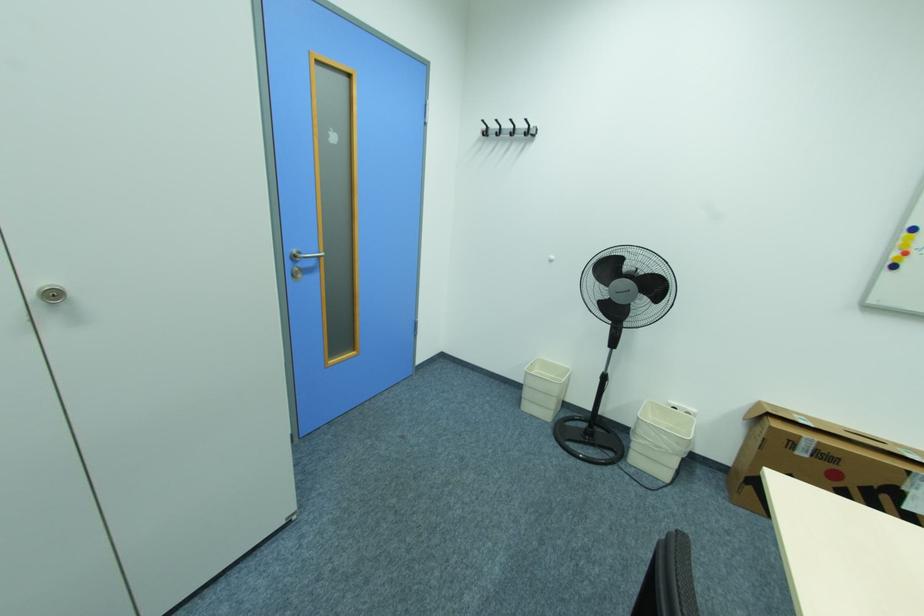
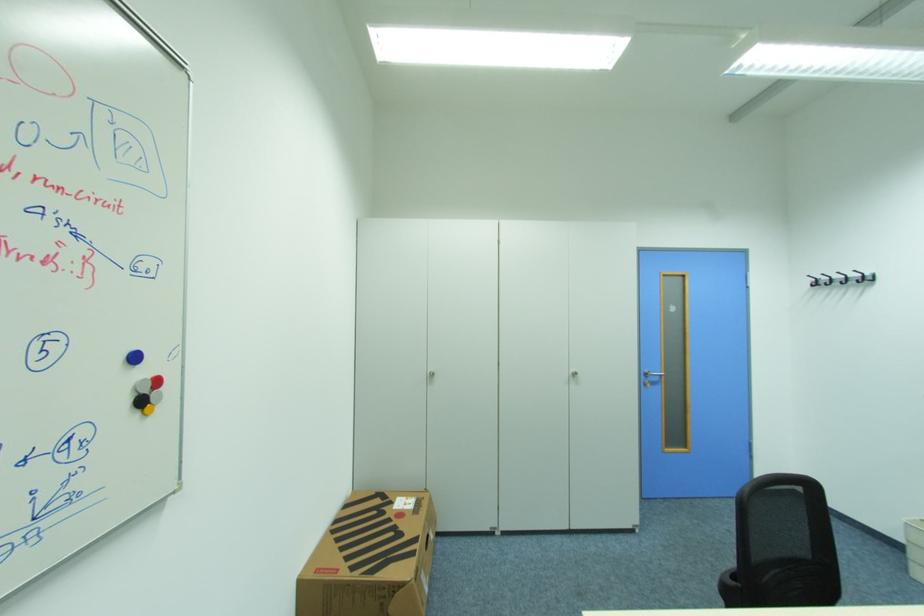
Locate, in the second image, the point that corresponds to point (537, 127) in the first image.

(872, 275)